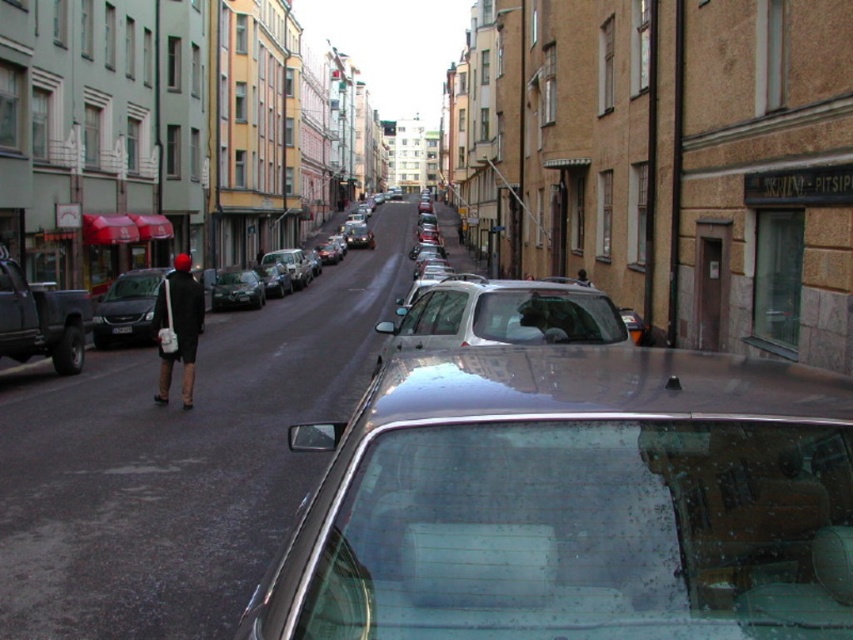
You are a pedestrian trying to cross the street. You notice a matte black coat at center and a white plastic license plate at center. Which object is closer to you?

The matte black coat at center is closer to you because it is positioned over the white plastic license plate at center.